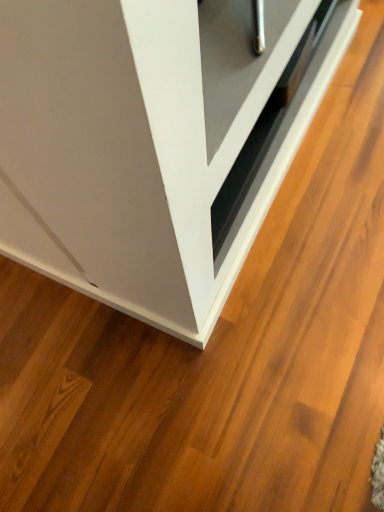
Question: From the image's perspective, would you say white glossy cabinet at lower right is shown under matte black drawer at center?

Choices:
 (A) yes
 (B) no

Answer: (A)

Question: Can you confirm if white glossy cabinet at lower right is taller than matte black drawer at center?

Choices:
 (A) no
 (B) yes

Answer: (B)

Question: Could you tell me if white glossy cabinet at lower right is turned towards matte black drawer at center?

Choices:
 (A) no
 (B) yes

Answer: (A)

Question: From a real-world perspective, does white glossy cabinet at lower right sit lower than matte black drawer at center?

Choices:
 (A) yes
 (B) no

Answer: (A)

Question: Is white glossy cabinet at lower right next to matte black drawer at center?

Choices:
 (A) yes
 (B) no

Answer: (B)

Question: Is the position of white glossy cabinet at lower right more distant than that of matte black drawer at center?

Choices:
 (A) no
 (B) yes

Answer: (A)

Question: Is matte black drawer at center directly adjacent to white glossy cabinet at lower right?

Choices:
 (A) no
 (B) yes

Answer: (A)

Question: Is matte black drawer at center positioned before white glossy cabinet at lower right?

Choices:
 (A) no
 (B) yes

Answer: (A)

Question: Are matte black drawer at center and white glossy cabinet at lower right far apart?

Choices:
 (A) no
 (B) yes

Answer: (A)

Question: Does matte black drawer at center have a smaller size compared to white glossy cabinet at lower right?

Choices:
 (A) no
 (B) yes

Answer: (B)

Question: Is matte black drawer at center further to camera compared to white glossy cabinet at lower right?

Choices:
 (A) no
 (B) yes

Answer: (B)

Question: Is matte black drawer at center outside of white glossy cabinet at lower right?

Choices:
 (A) yes
 (B) no

Answer: (A)

Question: From a real-world perspective, relative to white glossy cabinet at lower right, is matte black drawer at center vertically above or below?

Choices:
 (A) above
 (B) below

Answer: (A)